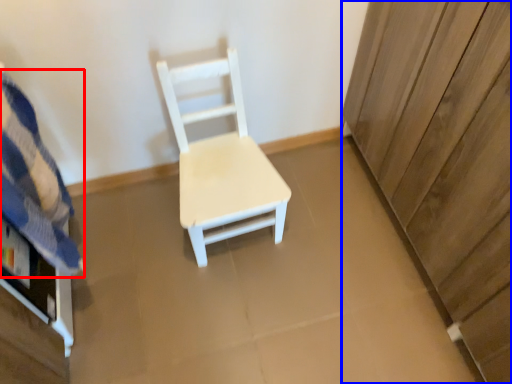
Question: Among these objects, which one is nearest to the camera, bedding (highlighted by a red box) or dresser (highlighted by a blue box)?

Choices:
 (A) bedding
 (B) dresser

Answer: (B)